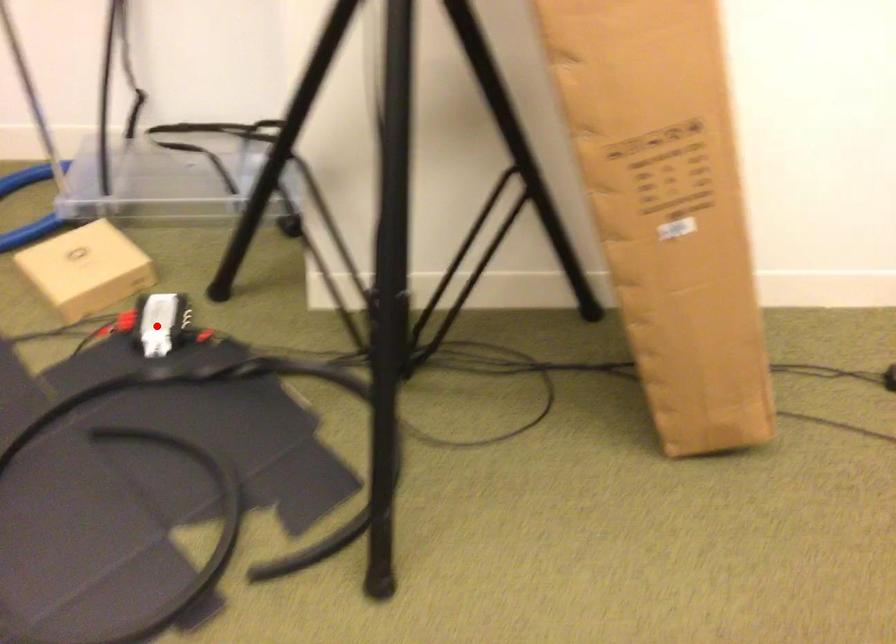
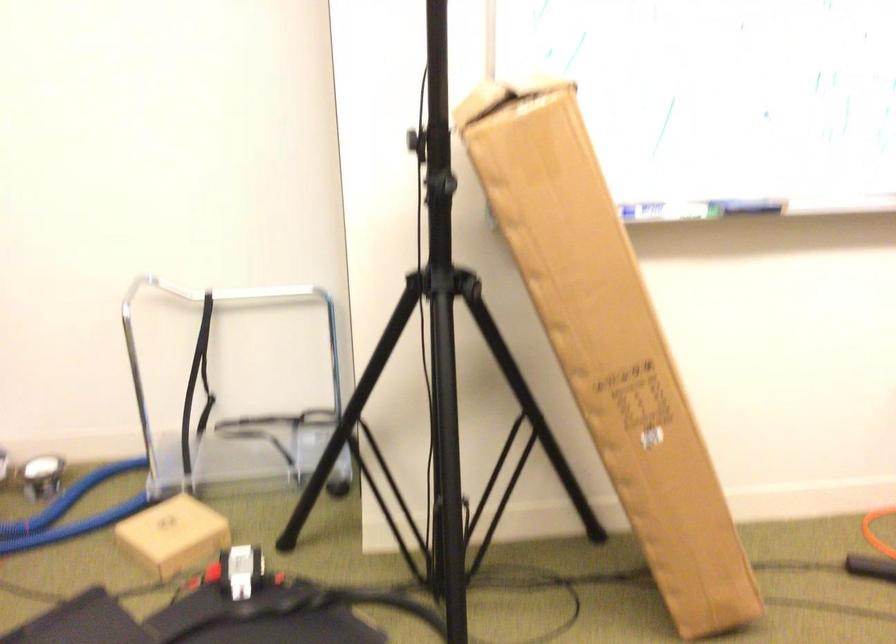
In the second image, find the point that corresponds to the highlighted location in the first image.

(242, 572)